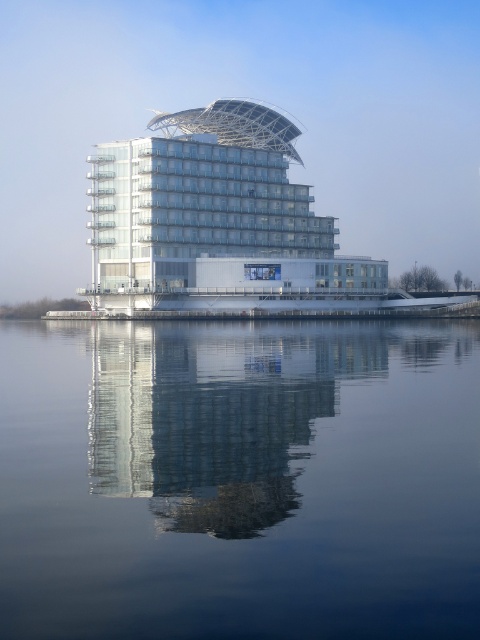
You are an architect reviewing a design. The transparent glass water at center and the white glass building at center are part of the model. Which one has a smaller thickness in the model?

The transparent glass water at center is thinner than the white glass building at center, so the transparent glass water at center has a smaller thickness in the model.

You are an architect reviewing a design proposal for a lakeside building. The proposal includes two versions of the building design labeled as the smooth glass building at center and the white glass building at center. Based on the provided image, which building design is larger in size?

The white glass building at center is larger than the smooth glass building at center.

You are standing on the dock and see the transparent glass water at center and the white glass building at center. Which object is located to the right side from your perspective?

The transparent glass water at center is to the right of the white glass building at center, so it is located to the right side from your perspective.